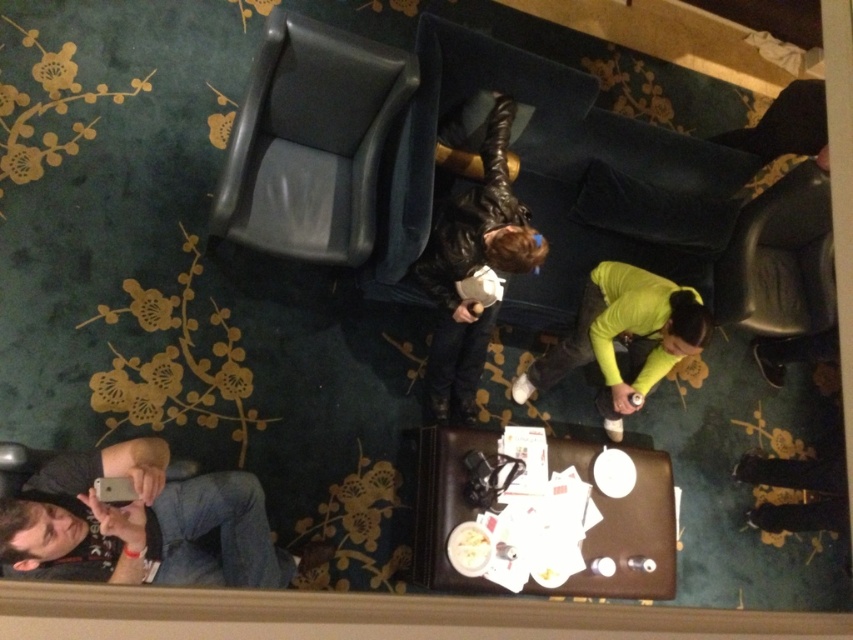
Question: Can you confirm if brown leather luggage at center is bigger than neon yellow long-sleeve shirt at center?

Choices:
 (A) yes
 (B) no

Answer: (B)

Question: Which object appears closest to the camera in this image?

Choices:
 (A) jeans at lower left
 (B) black leather chair at right
 (C) brown leather luggage at center
 (D) neon yellow long-sleeve shirt at center

Answer: (A)

Question: Which point is farther from the camera taking this photo?

Choices:
 (A) (9, 547)
 (B) (273, 220)
 (C) (746, 268)
 (D) (460, 467)

Answer: (C)

Question: Can you confirm if matte black chair at upper left is positioned to the left of black leather chair at right?

Choices:
 (A) yes
 (B) no

Answer: (A)

Question: Is jeans at lower left positioned in front of black leather chair at right?

Choices:
 (A) no
 (B) yes

Answer: (B)

Question: Which of the following is the closest to the observer?

Choices:
 (A) brown leather luggage at center
 (B) matte black chair at upper left

Answer: (B)